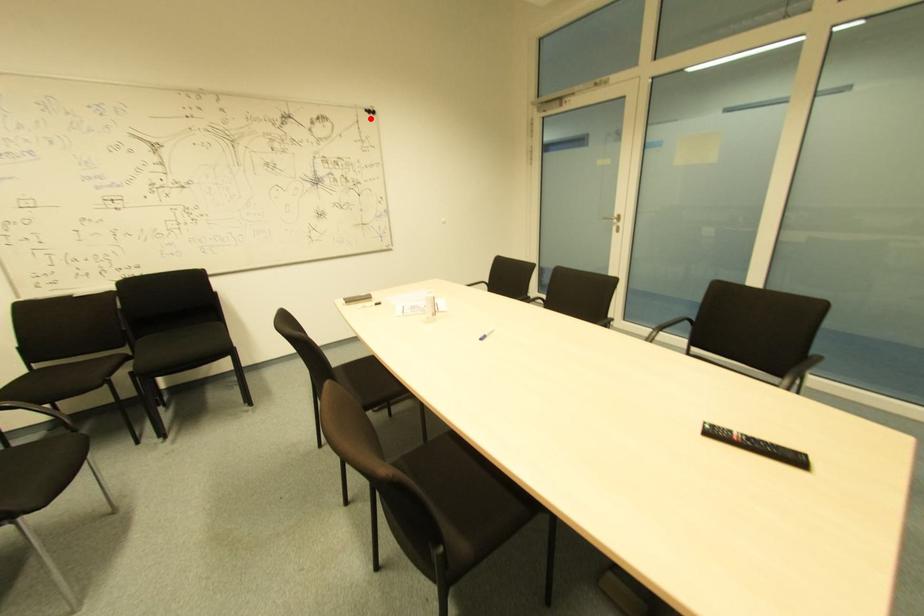
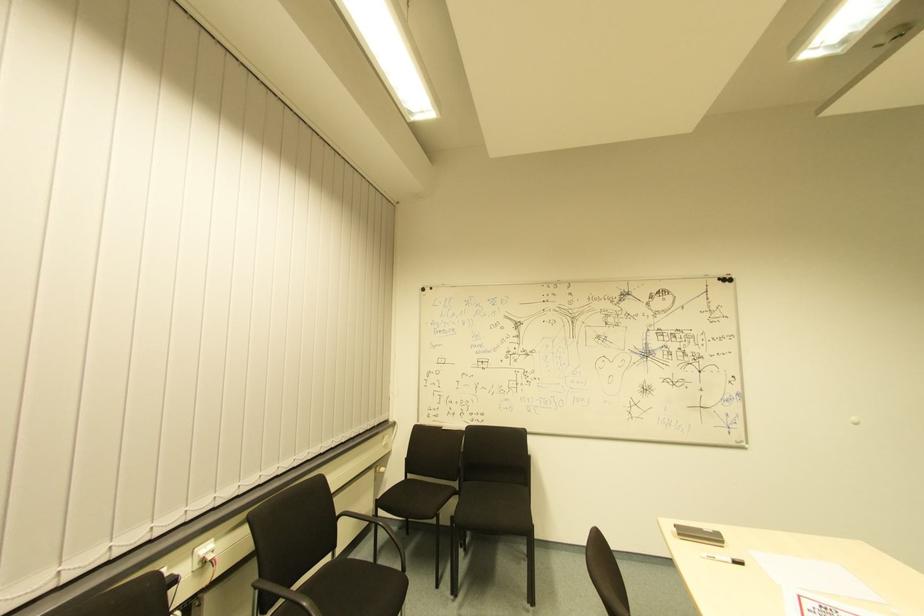
Question: I am providing you with two images of the same scene from different viewpoints. A red point is shown in image1. For the corresponding object point in image2, is it positioned nearer or farther from the camera?

Choices:
 (A) Nearer
 (B) Farther

Answer: (B)